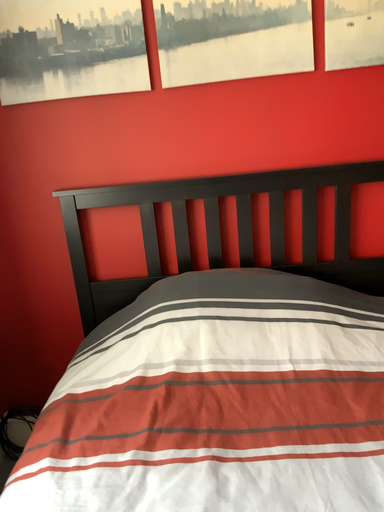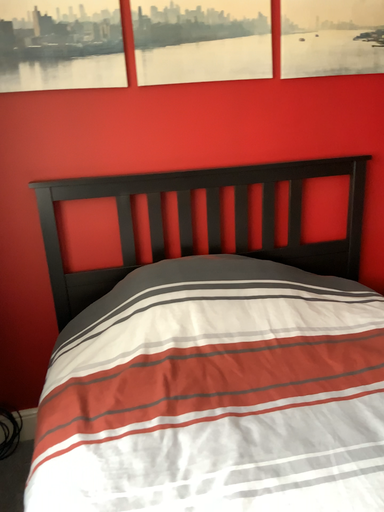
Question: How did the camera likely rotate when shooting the video?

Choices:
 (A) rotated right
 (B) rotated left

Answer: (A)